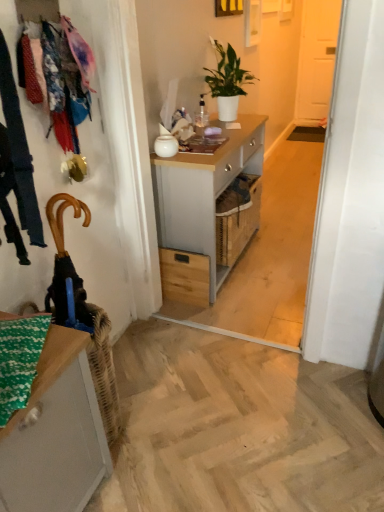
Question: Can you confirm if matte gray cabinet at lower left is smaller than white glossy vase at center?

Choices:
 (A) no
 (B) yes

Answer: (A)

Question: Considering the relative sizes of matte gray cabinet at lower left and white glossy vase at center in the image provided, is matte gray cabinet at lower left shorter than white glossy vase at center?

Choices:
 (A) no
 (B) yes

Answer: (A)

Question: Does matte gray cabinet at lower left have a greater height compared to white glossy vase at center?

Choices:
 (A) no
 (B) yes

Answer: (B)

Question: Does matte gray cabinet at lower left have a greater width compared to white glossy vase at center?

Choices:
 (A) yes
 (B) no

Answer: (A)

Question: Considering the relative positions of matte gray cabinet at lower left and white glossy vase at center in the image provided, is matte gray cabinet at lower left to the right of white glossy vase at center from the viewer's perspective?

Choices:
 (A) yes
 (B) no

Answer: (B)

Question: Is white glossy vase at center at the back of matte gray cabinet at lower left?

Choices:
 (A) yes
 (B) no

Answer: (B)

Question: From a real-world perspective, is white glossy vase at center positioned under light gray wood desk at center based on gravity?

Choices:
 (A) yes
 (B) no

Answer: (B)

Question: Is white glossy vase at center not close to light gray wood desk at center?

Choices:
 (A) yes
 (B) no

Answer: (B)

Question: Is white glossy vase at center at the left side of light gray wood desk at center?

Choices:
 (A) yes
 (B) no

Answer: (A)

Question: Is white glossy vase at center taller than light gray wood desk at center?

Choices:
 (A) no
 (B) yes

Answer: (A)

Question: Is white glossy vase at center not inside light gray wood desk at center?

Choices:
 (A) yes
 (B) no

Answer: (A)

Question: From the image's perspective, is white glossy vase at center beneath light gray wood desk at center?

Choices:
 (A) no
 (B) yes

Answer: (A)

Question: Considering the relative sizes of matte gray cabinet at lower left and light gray wood desk at center in the image provided, is matte gray cabinet at lower left shorter than light gray wood desk at center?

Choices:
 (A) yes
 (B) no

Answer: (A)